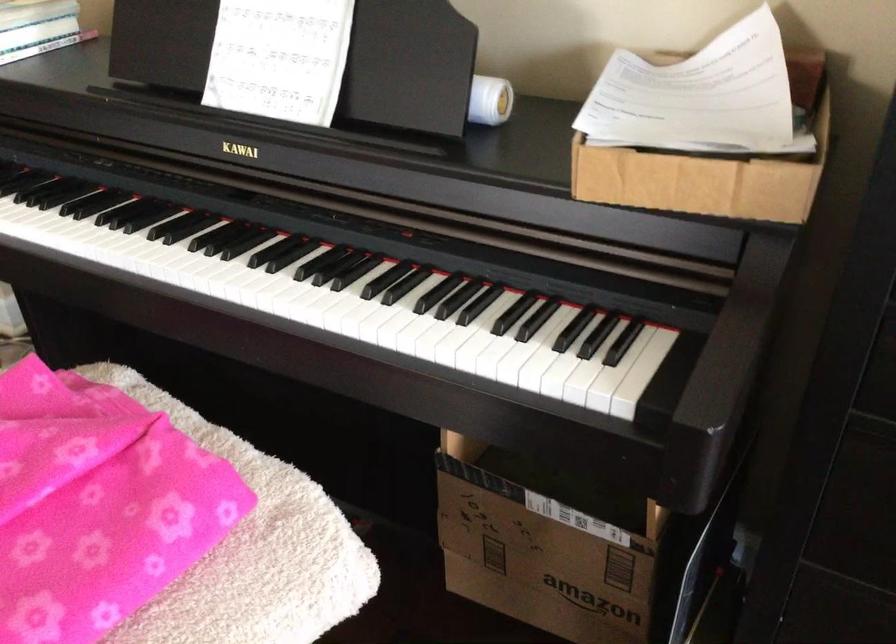
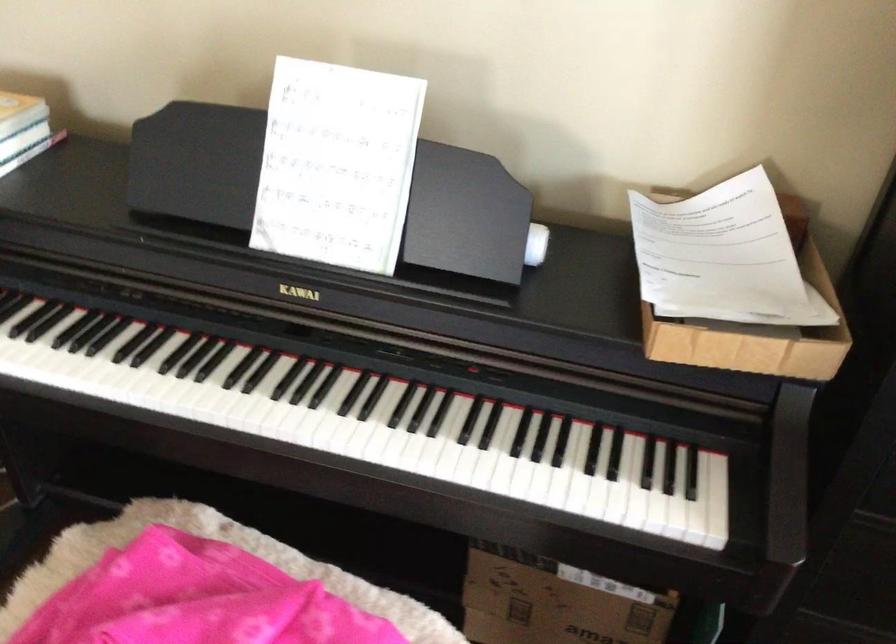
The point at (409, 286) is marked in the first image. Where is the corresponding point in the second image?

(489, 424)